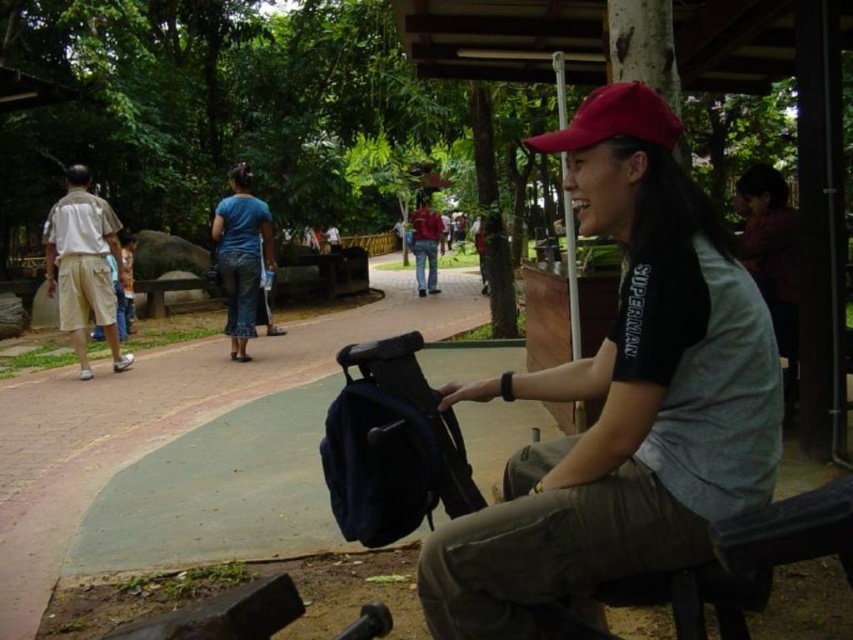
Question: Can you confirm if light beige cotton shorts at left is wider than blue denim jeans at center?

Choices:
 (A) yes
 (B) no

Answer: (A)

Question: Is blue denim jeans at center positioned before denim jeans at center?

Choices:
 (A) yes
 (B) no

Answer: (A)

Question: Which object is positioned farthest from the blue denim jeans at center?

Choices:
 (A) denim jeans at center
 (B) light beige cotton shorts at left
 (C) red matte cap at upper center

Answer: (A)

Question: Which of the following is the farthest from the observer?

Choices:
 (A) (624, 134)
 (B) (616, 97)
 (C) (416, 266)

Answer: (C)

Question: Which object appears farthest from the camera in this image?

Choices:
 (A) matte black backpack at center
 (B) denim jeans at center
 (C) blue denim jeans at center

Answer: (B)

Question: Is light beige cotton shorts at left bigger than denim jeans at center?

Choices:
 (A) yes
 (B) no

Answer: (A)